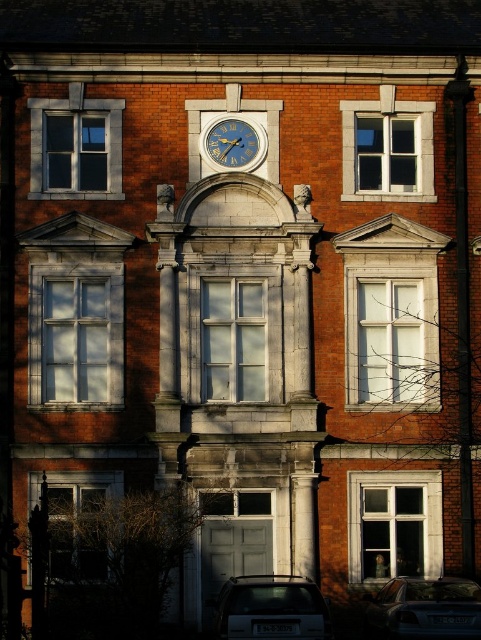
Is point (416, 614) farther from camera compared to point (64, 513)?

No, it is not.

Can you confirm if metallic silver car at lower right is taller than matte glass window at lower left?

Incorrect, metallic silver car at lower right's height is not larger of matte glass window at lower left's.

Is point (460, 593) more distant than point (28, 500)?

No, it is in front of (28, 500).

This screenshot has height=640, width=481. Find the location of `metallic silver car at lower right`. metallic silver car at lower right is located at coordinates coord(425,609).

Between white glass window at center right and white glass window at center, which one has less height?

white glass window at center right

Find the location of `white glass window at center right`. white glass window at center right is located at coordinates (391, 312).

Find the location of a particular element. white glass window at center right is located at coordinates 391,312.

Does matte glass window at upper left come behind metallic silver car at lower right?

That is True.

Who is positioned more to the left, matte glass window at upper left or metallic silver car at lower right?

matte glass window at upper left

Does point (73, 129) lie behind point (378, 611)?

That is True.

At what (x,y) coordinates should I click in order to perform the action: click on matte glass window at upper left. Please return your answer as a coordinate pair (x, y). The width and height of the screenshot is (481, 640). Looking at the image, I should click on (75, 147).